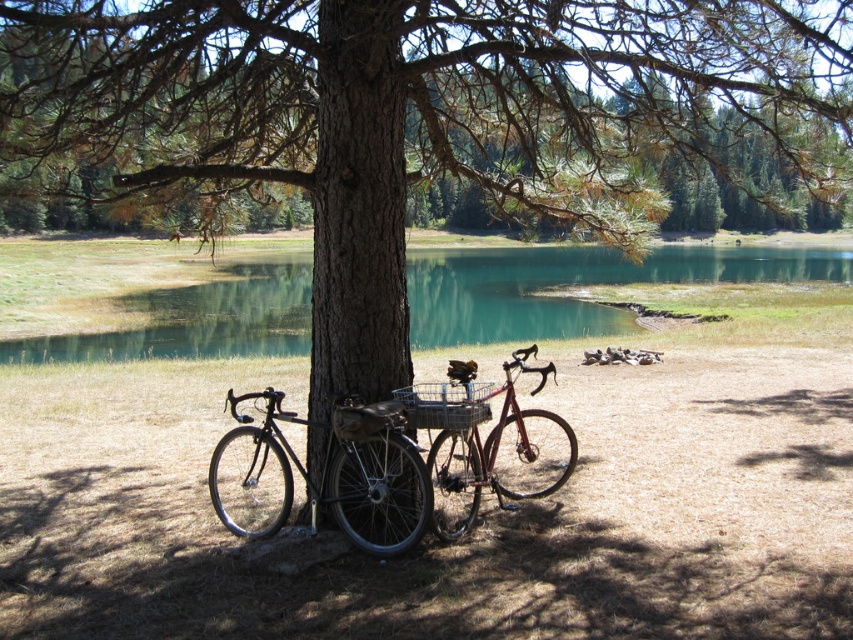
You are a photographer wanting to capture the shiny black bicycle at center and the green water at center in a single shot. To ensure both are in focus, which object should you position closer to the camera?

The shiny black bicycle at center is behind the green water at center, so you should position the green water at center closer to the camera to ensure both are in focus.

You are standing in front of the tree and want to place a small flag at each of the two points labeled point (282, 451) and point (508, 422). Which point will require you to walk further away from the tree to place the flag?

Point (508, 422) will require you to walk further away from the tree because it is farther from the camera compared to point (282, 451).

You are standing in the middle of the scene and want to move towards the tree trunk. Which bicycle, the shiny black bicycle at center or the shiny red bicycle at center, is in your way?

The shiny black bicycle at center is below the shiny red bicycle at center, so the shiny black bicycle at center is lower and closer to the ground. Since you are moving towards the tree trunk from the center, the shiny black bicycle at center would be in your way first.